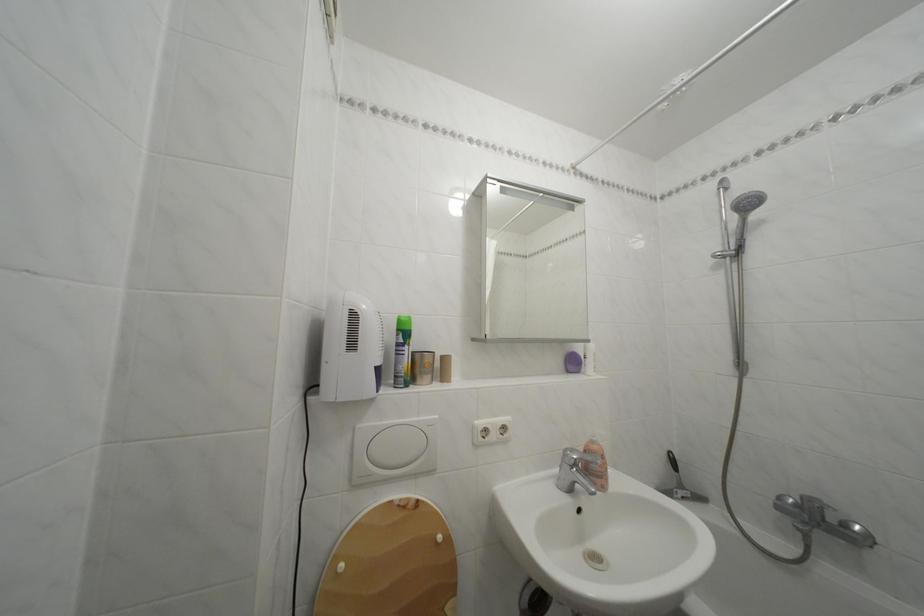
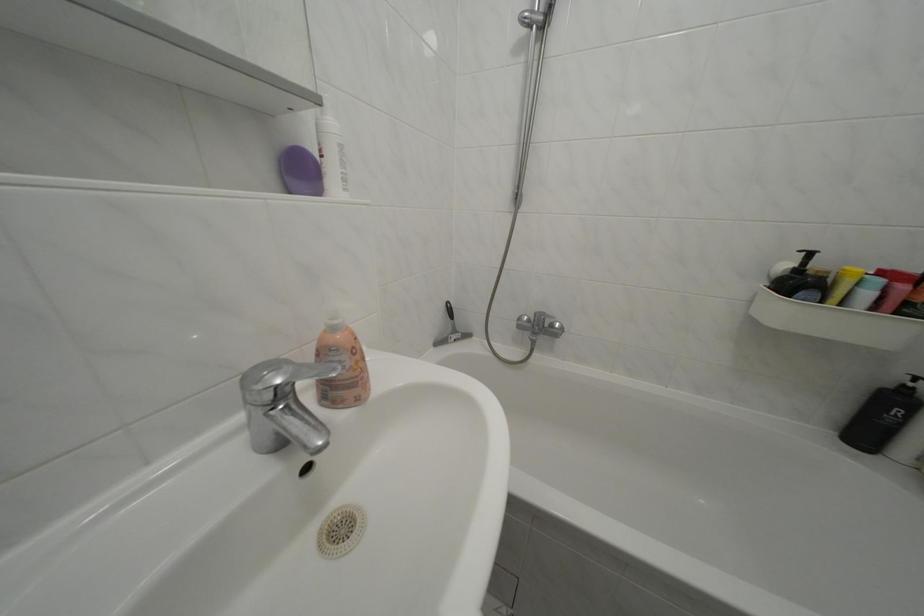
The point at (602, 448) is marked in the first image. Where is the corresponding point in the second image?

(342, 334)